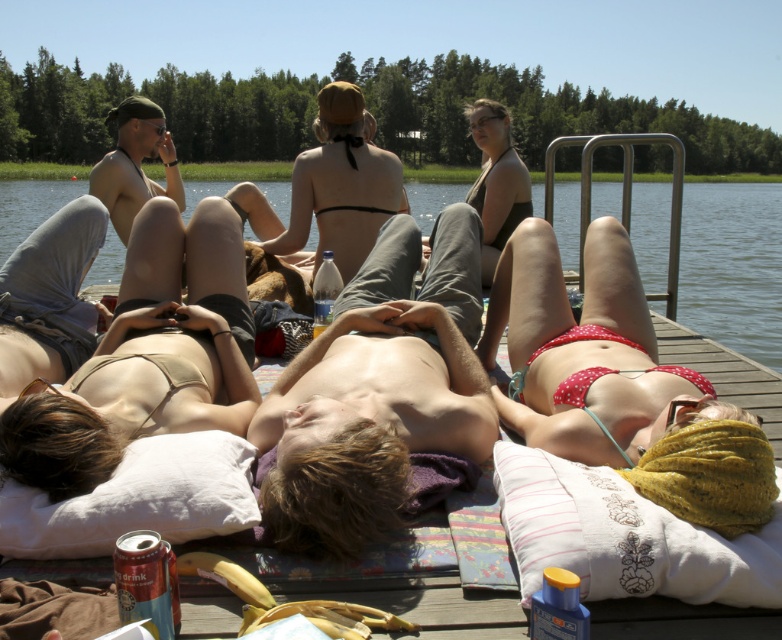
Is point (712, 577) farther from camera compared to point (210, 461)?

No, it is in front of (210, 461).

This screenshot has height=640, width=782. I want to click on white embroidered pillow at lower right, so click(x=623, y=536).

Find the location of a particular element. white embroidered pillow at lower right is located at coordinates (623, 536).

Can you confirm if black bikini at center is smaller than matte black bikini at center?

Indeed, black bikini at center has a smaller size compared to matte black bikini at center.

This screenshot has height=640, width=782. Find the location of `black bikini at center`. black bikini at center is located at coordinates (341, 186).

Based on the photo, is white soft pillow at lower left thinner than black bikini at center?

No.

Between white soft pillow at lower left and black bikini at center, which one is positioned lower?

white soft pillow at lower left is below.

What do you see at coordinates (137, 499) in the screenshot?
I see `white soft pillow at lower left` at bounding box center [137, 499].

The height and width of the screenshot is (640, 782). In order to click on white soft pillow at lower left in this screenshot , I will do `click(137, 499)`.